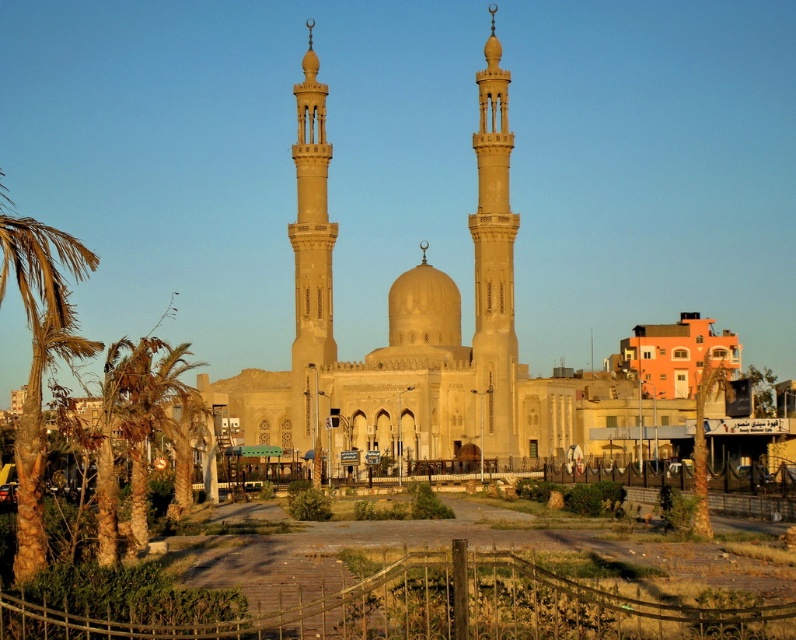
Question: Is brown textured palm tree at left to the right of green leafy palm tree at left from the viewer's perspective?

Choices:
 (A) no
 (B) yes

Answer: (A)

Question: Based on their relative distances, which object is nearer to the brown textured palm tree at left?

Choices:
 (A) beige stone minaret at center-left
 (B) green leafy palm tree at left

Answer: (B)

Question: Is beige stone minaret at center above brown textured palm tree at left?

Choices:
 (A) yes
 (B) no

Answer: (A)

Question: Is green leafy palm tree at left wider than beige stone minaret at center-left?

Choices:
 (A) no
 (B) yes

Answer: (B)

Question: Which object is closer to the camera taking this photo?

Choices:
 (A) brown textured palm tree at left
 (B) green leafy palm tree at left

Answer: (A)

Question: Which of the following is the farthest from the observer?

Choices:
 (A) (513, 397)
 (B) (60, 333)
 (C) (150, 428)
 (D) (313, 337)

Answer: (D)